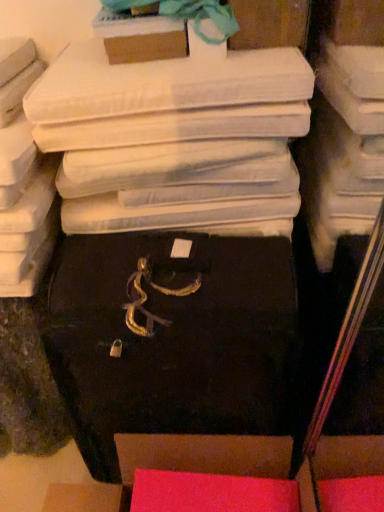
Question: In which direction should I rotate to look at matte pink box at lower center, marked as the first storage box in a bottom-to-top arrangement?

Choices:
 (A) right
 (B) left

Answer: (B)

Question: Is matte pink box at lower center, marked as the first storage box in a bottom-to-top arrangement, oriented towards black matte suitcase at center, the third storage box in the top-to-bottom sequence?

Choices:
 (A) no
 (B) yes

Answer: (A)

Question: Considering the relative sizes of matte pink box at lower center, marked as the first storage box in a bottom-to-top arrangement, and black matte suitcase at center, the third storage box in the top-to-bottom sequence, in the image provided, is matte pink box at lower center, marked as the first storage box in a bottom-to-top arrangement, taller than black matte suitcase at center, the third storage box in the top-to-bottom sequence,?

Choices:
 (A) yes
 (B) no

Answer: (B)

Question: Can you confirm if matte pink box at lower center, marked as the first storage box in a bottom-to-top arrangement, is shorter than black matte suitcase at center, the third storage box in the top-to-bottom sequence?

Choices:
 (A) no
 (B) yes

Answer: (B)

Question: Does matte pink box at lower center, acting as the 4th storage box starting from the top, lie in front of black matte suitcase at center, which appears as the second storage box when ordered from the bottom?

Choices:
 (A) yes
 (B) no

Answer: (B)

Question: From a real-world perspective, is matte pink box at lower center, acting as the 4th storage box starting from the top, positioned under black matte suitcase at center, which appears as the second storage box when ordered from the bottom, based on gravity?

Choices:
 (A) no
 (B) yes

Answer: (B)

Question: Can we say matte pink box at lower center, acting as the 4th storage box starting from the top, lies outside black matte suitcase at center, the third storage box in the top-to-bottom sequence?

Choices:
 (A) yes
 (B) no

Answer: (A)

Question: Considering the relative positions of black matte suitcase at center, which appears as the second storage box when ordered from the bottom, and matte pink box at lower center, marked as the first storage box in a bottom-to-top arrangement, in the image provided, is black matte suitcase at center, which appears as the second storage box when ordered from the bottom, to the left of matte pink box at lower center, marked as the first storage box in a bottom-to-top arrangement, from the viewer's perspective?

Choices:
 (A) no
 (B) yes

Answer: (A)

Question: From a real-world perspective, is black matte suitcase at center, the third storage box in the top-to-bottom sequence, on top of matte pink box at lower center, marked as the first storage box in a bottom-to-top arrangement?

Choices:
 (A) no
 (B) yes

Answer: (B)

Question: From the image's perspective, is black matte suitcase at center, the third storage box in the top-to-bottom sequence, above matte pink box at lower center, acting as the 4th storage box starting from the top?

Choices:
 (A) yes
 (B) no

Answer: (A)

Question: Does black matte suitcase at center, which appears as the second storage box when ordered from the bottom, have a larger size compared to matte pink box at lower center, marked as the first storage box in a bottom-to-top arrangement?

Choices:
 (A) yes
 (B) no

Answer: (A)

Question: Is black matte suitcase at center, the third storage box in the top-to-bottom sequence, closer to camera compared to matte pink box at lower center, marked as the first storage box in a bottom-to-top arrangement?

Choices:
 (A) yes
 (B) no

Answer: (A)

Question: Is black matte suitcase at center, the third storage box in the top-to-bottom sequence, aimed at matte pink box at lower center, marked as the first storage box in a bottom-to-top arrangement?

Choices:
 (A) yes
 (B) no

Answer: (A)

Question: Does matte cardboard box at upper center, which is the third storage box from bottom to top, come in front of matte white storage box at upper center, which is counted as the 4th storage box, starting from the bottom?

Choices:
 (A) yes
 (B) no

Answer: (A)